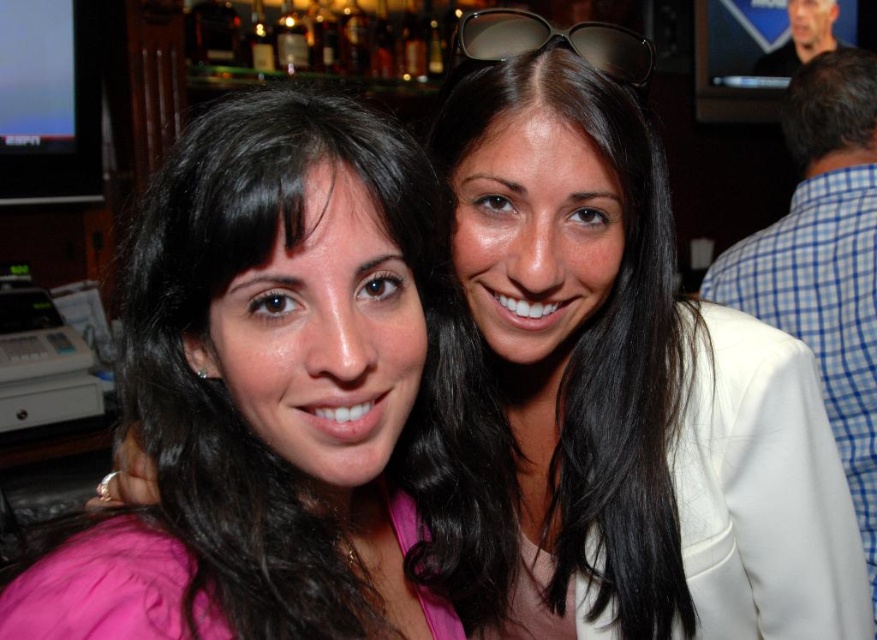
Question: Can you confirm if pink fabric at center is smaller than white fabric jacket at right?

Choices:
 (A) yes
 (B) no

Answer: (A)

Question: Can you confirm if pink fabric at center is positioned above smooth black hair at center?

Choices:
 (A) no
 (B) yes

Answer: (A)

Question: Which object appears closest to the camera in this image?

Choices:
 (A) smooth black hair at center
 (B) brown reflective sunglasses at upper center
 (C) pink fabric at center

Answer: (C)

Question: Is white fabric jacket at right thinner than brown reflective sunglasses at upper center?

Choices:
 (A) yes
 (B) no

Answer: (B)

Question: Which object appears closest to the camera in this image?

Choices:
 (A) pink fabric at center
 (B) brown reflective sunglasses at upper center
 (C) smooth black hair at center

Answer: (A)

Question: Which is farther from the smooth black hair at center?

Choices:
 (A) white fabric jacket at right
 (B) brown reflective sunglasses at upper center

Answer: (A)